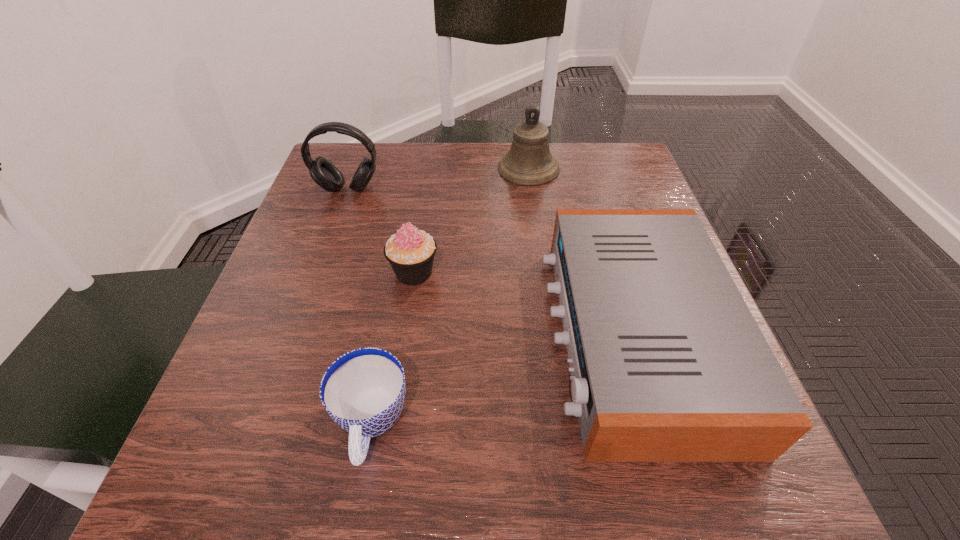
Where is `vacant space situated on the control panel of the radio receiver`? vacant space situated on the control panel of the radio receiver is located at coordinates (368, 335).

This screenshot has height=540, width=960. I want to click on bell that is positioned at the far edge, so click(x=528, y=162).

Locate an element on the screen. headset that is at the far edge is located at coordinates (323, 172).

Identify the location of radio receiver at the near edge. (668, 364).

I want to click on cup that is at the near edge, so click(363, 391).

You are a GUI agent. You are given a task and a screenshot of the screen. Output one action in this format:
    pyautogui.click(x=<x>, y=<y>)
    Task: Click on the object located at the left edge
    The height and width of the screenshot is (540, 960).
    Given the screenshot: What is the action you would take?
    pyautogui.click(x=323, y=172)

At what (x,y) coordinates should I click in order to perform the action: click on object present at the right edge. Please return your answer as a coordinate pair (x, y). The height and width of the screenshot is (540, 960). Looking at the image, I should click on (668, 364).

This screenshot has width=960, height=540. What are the coordinates of `object that is at the far left corner` in the screenshot? It's located at (323, 172).

Find the location of a particular element. This screenshot has height=540, width=960. object present at the near right corner is located at coordinates (668, 364).

You are a GUI agent. You are given a task and a screenshot of the screen. Output one action in this format:
    pyautogui.click(x=<x>, y=<y>)
    Task: Click on the vacant space at the far edge
    The height and width of the screenshot is (540, 960).
    Given the screenshot: What is the action you would take?
    pyautogui.click(x=446, y=154)